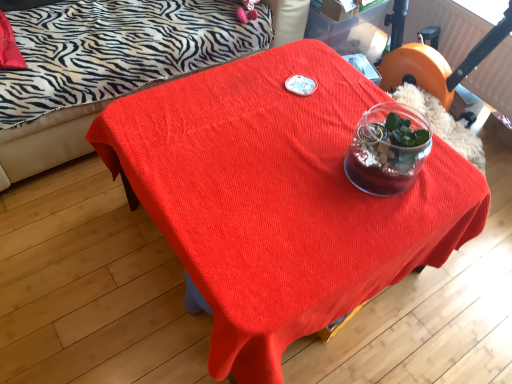
Locate an element on the screen. empty space that is ontop of matte red table at center is located at coordinates (276, 170).